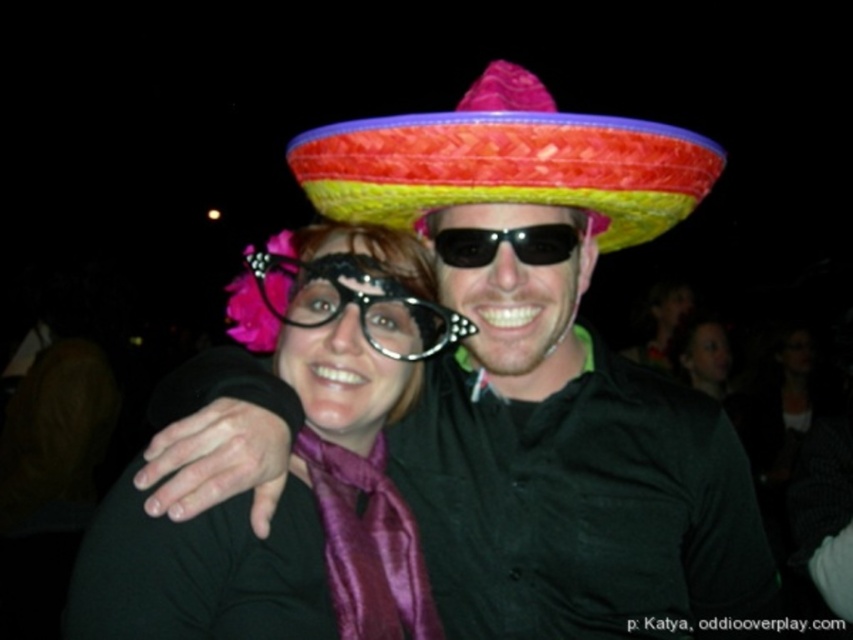
Question: Which point appears farthest from the camera in this image?

Choices:
 (A) (457, 403)
 (B) (720, 157)
 (C) (369, 328)

Answer: (A)

Question: Considering the real-world distances, which object is farthest from the black plastic glasses at center?

Choices:
 (A) purple satin scarf at center
 (B) matte purple scarf at center
 (C) black plastic sunglasses at center

Answer: (B)

Question: Estimate the real-world distances between objects in this image. Which object is closer to the multicolored woven sombrero at center?

Choices:
 (A) matte purple scarf at center
 (B) black plastic glasses at center

Answer: (B)

Question: Considering the relative positions of purple satin scarf at center and multicolored woven sombrero at center in the image provided, where is purple satin scarf at center located with respect to multicolored woven sombrero at center?

Choices:
 (A) right
 (B) left

Answer: (B)

Question: Can you confirm if black plastic glasses at center is positioned to the right of matte purple scarf at center?

Choices:
 (A) no
 (B) yes

Answer: (A)

Question: From the image, what is the correct spatial relationship of matte black shirt at center in relation to purple satin scarf at center?

Choices:
 (A) above
 (B) below

Answer: (A)